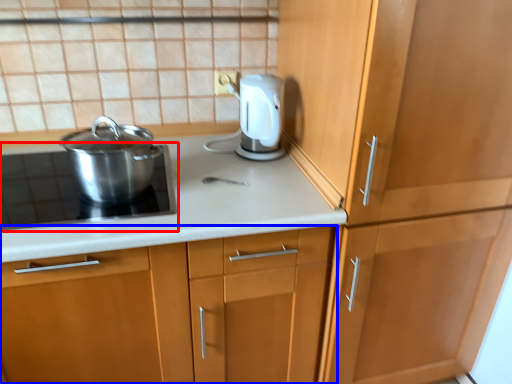
Question: Which object appears closest to the camera in this image, home appliance (highlighted by a red box) or cabinetry (highlighted by a blue box)?

Choices:
 (A) home appliance
 (B) cabinetry

Answer: (B)